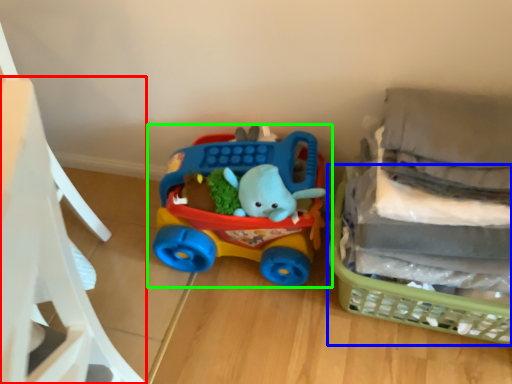
Question: Estimate the real-world distances between objects in this image. Which object is closer to chair (highlighted by a red box), basket (highlighted by a blue box) or toy (highlighted by a green box)?

Choices:
 (A) basket
 (B) toy

Answer: (B)